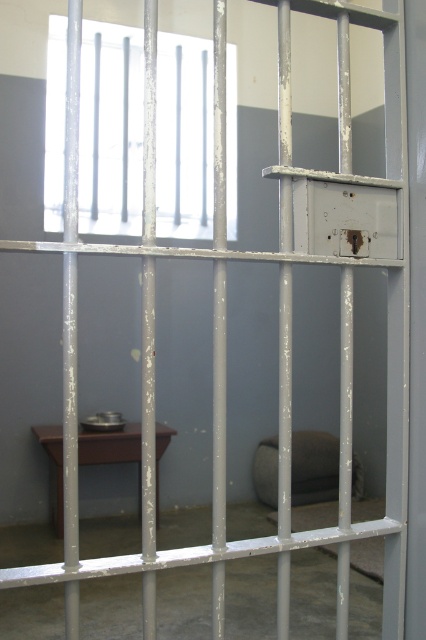
You are an inmate in the prison cell and want to see outside through the transparent glass window at upper center. However, there is a brown matte stool at lower left blocking your view. Can you move the stool to the side to get a clear view?

The transparent glass window at upper center is above the brown matte stool at lower left, so you can move the stool to the side to get a clear view since the window is positioned higher than the stool.

You are standing in front of the prison cell gate. There are two points marked on the wall behind the table. One is at coordinates point [100,173] and the other at point [103,456]. Which point is closer to you?

Point [100,173] is further to the viewer than point [103,456], so the closer point to you is point [103,456].

You are standing at the entrance of the prison cell looking in. There is a point marked at coordinates (x=313, y=467). What object is located at that point?

The point at coordinates (x=313, y=467) corresponds to the brown fabric stool at center.